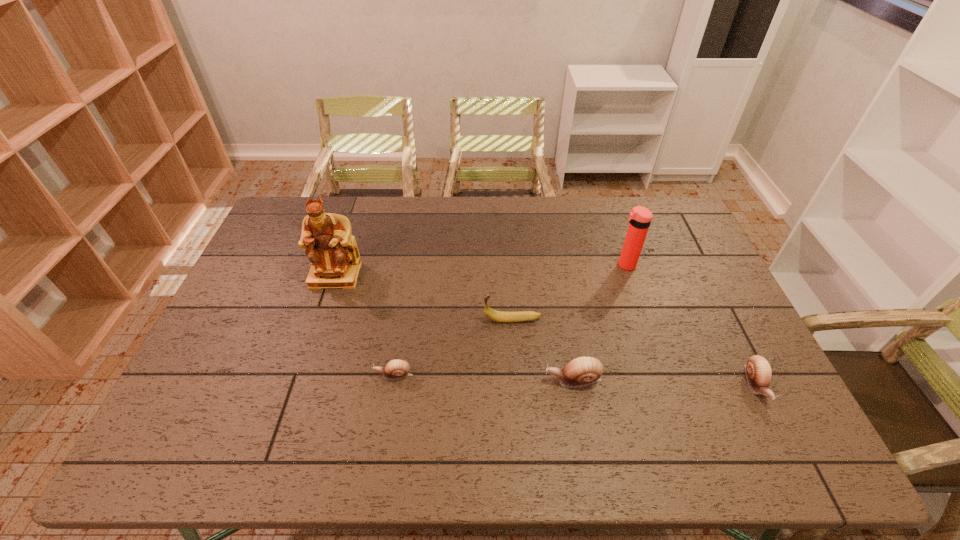
Where is `the leftmost object`? The image size is (960, 540). the leftmost object is located at coordinates (335, 261).

At what (x,y) coordinates should I click in order to perform the action: click on vacant region located on the front-facing side of the shortest object. Please return your answer as a coordinate pair (x, y). The image size is (960, 540). Looking at the image, I should click on (245, 375).

This screenshot has width=960, height=540. What are the coordinates of `free space located 0.210m on the front-facing side of the shortest object` in the screenshot? It's located at (295, 375).

What are the coordinates of `free location located on the front-facing side of the shortest object` in the screenshot? It's located at (245, 375).

Locate an element on the screen. This screenshot has height=540, width=960. vacant space situated 0.170m on the front-facing side of the second escargot from left to right is located at coordinates (479, 380).

I want to click on free space located 0.190m on the front-facing side of the second escargot from left to right, so click(471, 380).

Identify the location of free space located on the front-facing side of the second escargot from left to right. (417, 380).

Locate an element on the screen. vacant space located 0.160m at the stem of the fourth nearest object is located at coordinates (428, 320).

At what (x,y) coordinates should I click in order to perform the action: click on free space located 0.230m at the stem of the fourth nearest object. Please return your answer as a coordinate pair (x, y). This screenshot has height=540, width=960. Looking at the image, I should click on (404, 320).

The image size is (960, 540). Find the location of `blank space located at the stem of the fourth nearest object`. blank space located at the stem of the fourth nearest object is located at coordinates (367, 320).